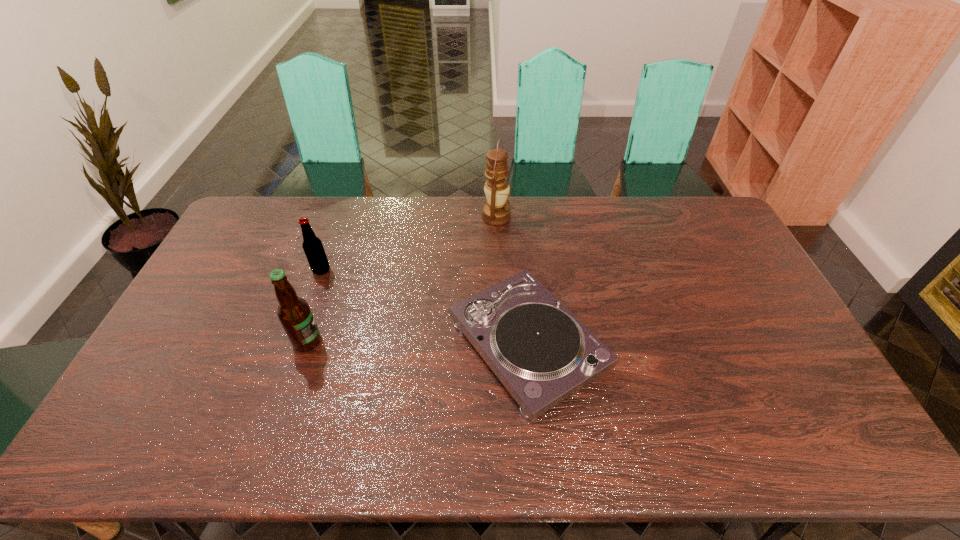
Find the location of a particular element. Image resolution: width=960 pixels, height=540 pixels. object at the near edge is located at coordinates (542, 353).

Where is `vacant space at the far edge of the desktop`? The height and width of the screenshot is (540, 960). vacant space at the far edge of the desktop is located at coordinates (379, 233).

The image size is (960, 540). In the image, there is a desktop. Identify the location of free space at the near edge. (416, 442).

Find the location of a particular element. This screenshot has width=960, height=540. vacant space at the left edge of the desktop is located at coordinates (270, 242).

Locate an element on the screen. vacant region at the right edge is located at coordinates (778, 380).

In the image, there is a desktop. Where is `free space at the far left corner`? The image size is (960, 540). free space at the far left corner is located at coordinates (234, 226).

This screenshot has height=540, width=960. I want to click on free space at the near left corner of the desktop, so click(136, 433).

Find the location of a particular element. The image size is (960, 540). free space at the near right corner of the desktop is located at coordinates (807, 447).

Find the location of a particular element. The height and width of the screenshot is (540, 960). vacant region between the second farthest object and the shortest object is located at coordinates (424, 307).

This screenshot has width=960, height=540. What are the coordinates of `free space between the farthest object and the shorter beer bottle` in the screenshot? It's located at (409, 244).